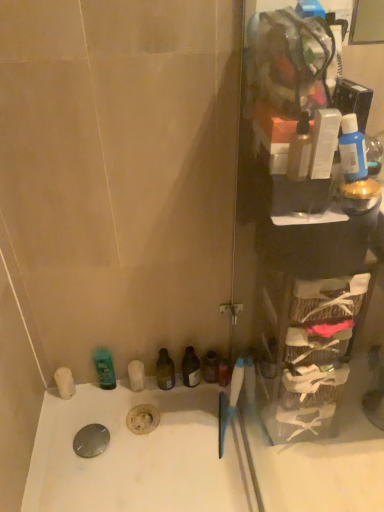
Question: Is green matte mouthwash at lower left, the first mouthwash positioned from the bottom, to the left or to the right of translucent plastic bottle at upper right, acting as the 4th mouthwash starting from the bottom, in the image?

Choices:
 (A) right
 (B) left

Answer: (B)

Question: Is green matte mouthwash at lower left, the first mouthwash viewed from the left, inside the boundaries of translucent plastic bottle at upper right, which ranks as the second mouthwash in right-to-left order, or outside?

Choices:
 (A) outside
 (B) inside

Answer: (A)

Question: Which of these objects is positioned farthest from the transparent plastic shelf at right?

Choices:
 (A) white matte soap at lower left, which is the second toiletry in front-to-back order
 (B) purple matte bottle at lower center, the third mouthwash viewed from the left
 (C) white plastic bottle at upper right, the first toiletry positioned from the right
 (D) translucent plastic bottle at upper right, acting as the 4th mouthwash starting from the bottom
 (E) transparent glass bottle at lower center, positioned as the 4th mouthwash in right-to-left order

Answer: (A)

Question: Which object is positioned closest to the blue glossy bottle at upper right, the 5th mouthwash positioned from the left?

Choices:
 (A) white plastic bottle at upper right, which is the 2th toiletry from back to front
 (B) purple matte bottle at lower center, which is the third mouthwash in right-to-left order
 (C) blue plastic brush at right
 (D) transparent plastic shelf at right
 (E) translucent plastic bottle at upper right, acting as the 4th mouthwash starting from the bottom

Answer: (A)